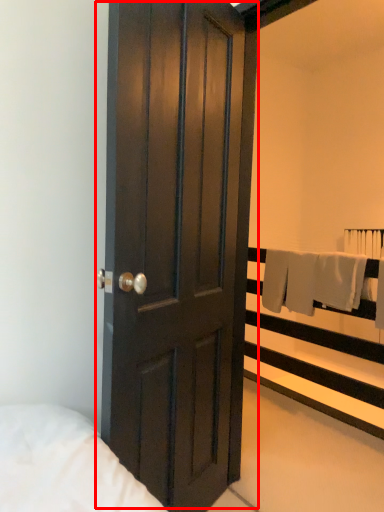
Question: From the image's perspective, where is door (annotated by the red box) located in relation to balustrade in the image?

Choices:
 (A) below
 (B) above

Answer: (B)